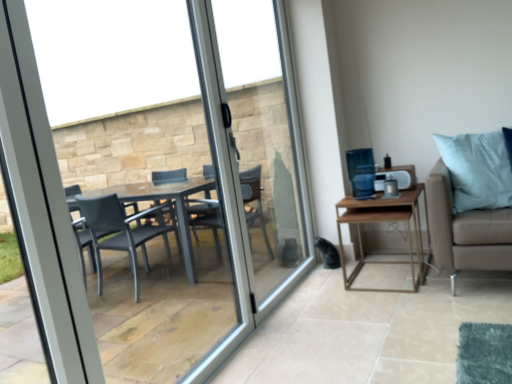
Question: Is clear glass door at center thinner than transparent glass window at center?

Choices:
 (A) no
 (B) yes

Answer: (B)

Question: Can you confirm if clear glass door at center is smaller than transparent glass window at center?

Choices:
 (A) no
 (B) yes

Answer: (A)

Question: Is the depth of clear glass door at center less than that of transparent glass window at center?

Choices:
 (A) yes
 (B) no

Answer: (B)

Question: Does clear glass door at center come behind transparent glass window at center?

Choices:
 (A) no
 (B) yes

Answer: (B)

Question: Would you say clear glass door at center is a long distance from transparent glass window at center?

Choices:
 (A) yes
 (B) no

Answer: (B)

Question: Is clear glass door at center shorter than transparent glass window at center?

Choices:
 (A) yes
 (B) no

Answer: (B)

Question: Is transparent glass window at center located outside clear glass door at center?

Choices:
 (A) no
 (B) yes

Answer: (B)

Question: Can you confirm if transparent glass window at center is bigger than clear glass door at center?

Choices:
 (A) no
 (B) yes

Answer: (A)

Question: Is transparent glass window at center far from clear glass door at center?

Choices:
 (A) yes
 (B) no

Answer: (B)

Question: Is transparent glass window at center thinner than clear glass door at center?

Choices:
 (A) yes
 (B) no

Answer: (B)

Question: Is transparent glass window at center aimed at clear glass door at center?

Choices:
 (A) yes
 (B) no

Answer: (B)

Question: Can you see transparent glass window at center touching clear glass door at center?

Choices:
 (A) yes
 (B) no

Answer: (B)

Question: Is clear glass door at center positioned beyond the bounds of wooden table at right?

Choices:
 (A) yes
 (B) no

Answer: (A)